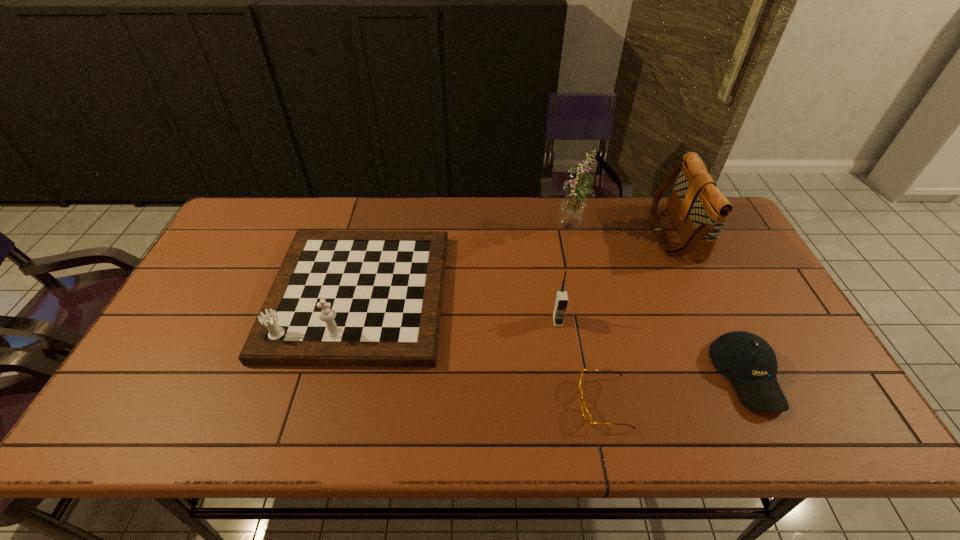
Identify the location of unoccupied area between the leftmost object and the tallest object. tap(465, 263).

Identify the location of object that stands as the closest to the leftmost object. The height and width of the screenshot is (540, 960). (561, 299).

In order to click on object that is the second closest to the fifth shortest object in this screenshot , I will do `click(750, 364)`.

Identify the location of vacant region that satisfies the following two spatial constraints: 1. on the front-facing side of the fifth tallest object; 2. on the front-facing side of the shortest object. This screenshot has width=960, height=540. [x=761, y=402].

This screenshot has height=540, width=960. I want to click on vacant space that satisfies the following two spatial constraints: 1. on the front-facing side of the bouquet; 2. on the front-facing side of the second object from left to right, so click(x=589, y=321).